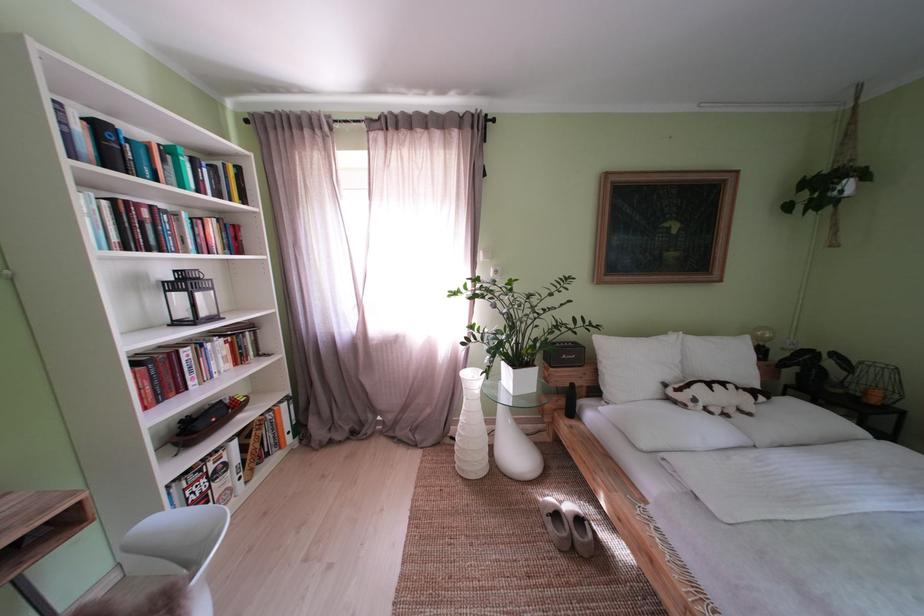
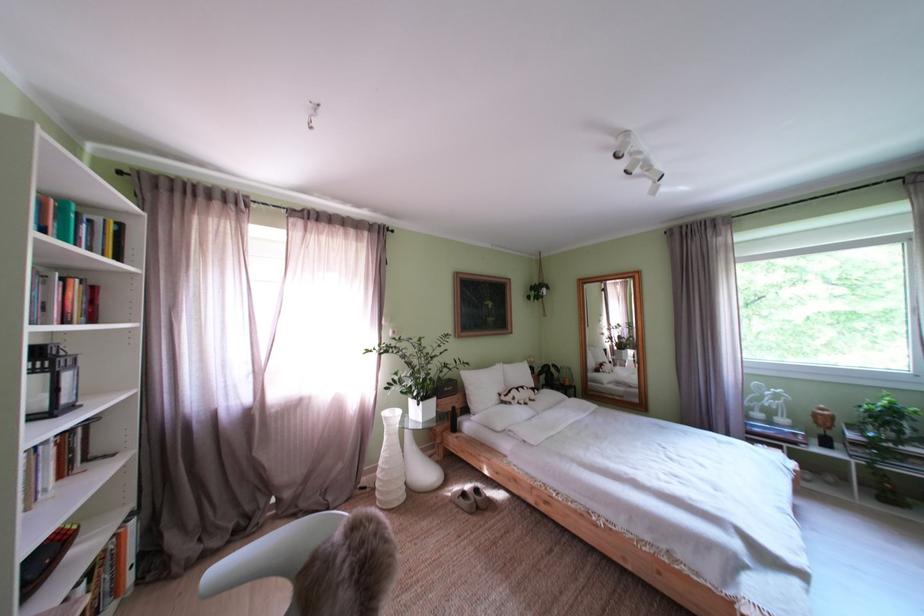
In the second image, find the point that corresponds to [757,415] in the first image.

(543, 403)